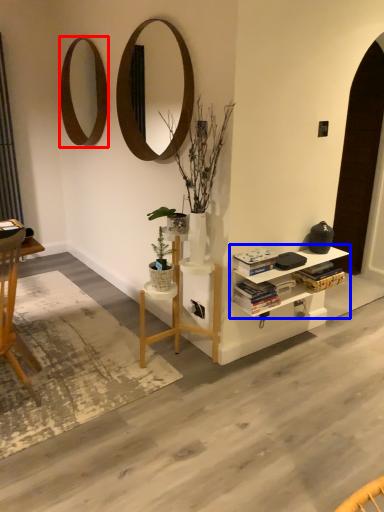
Question: Among these objects, which one is farthest to the camera, mirror (highlighted by a red box) or shelf (highlighted by a blue box)?

Choices:
 (A) mirror
 (B) shelf

Answer: (A)